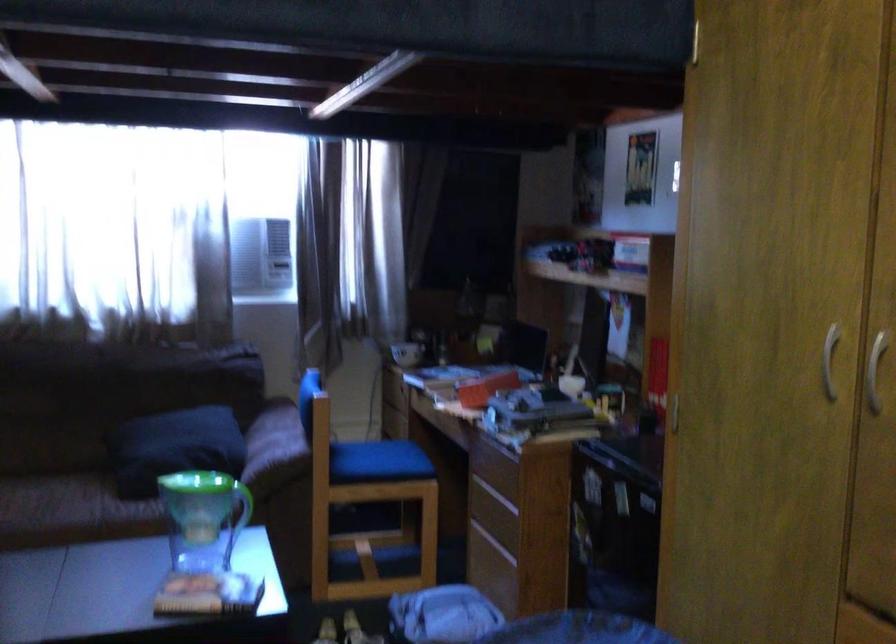
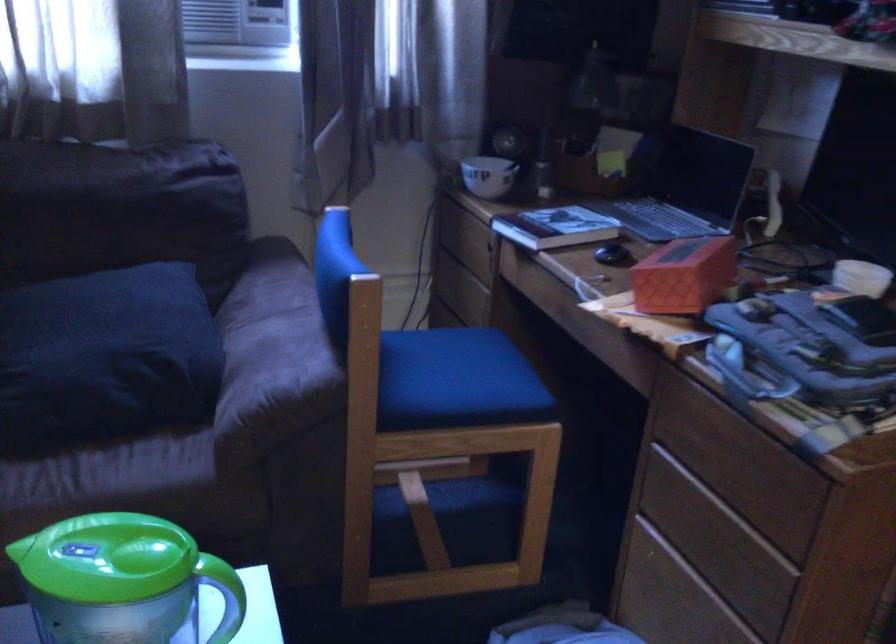
Where in the second image is the point corresponding to (405,351) from the first image?

(487, 176)